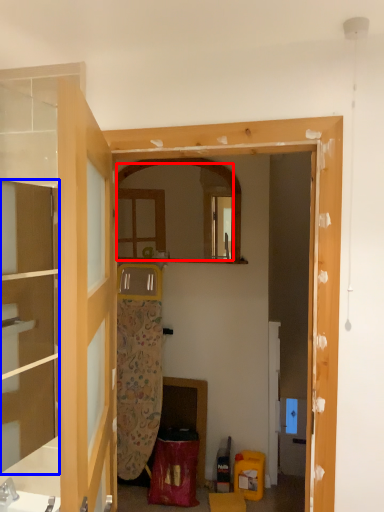
Question: Which object appears farthest to the camera in this image, mirror (highlighted by a red box) or cabinetry (highlighted by a blue box)?

Choices:
 (A) mirror
 (B) cabinetry

Answer: (A)